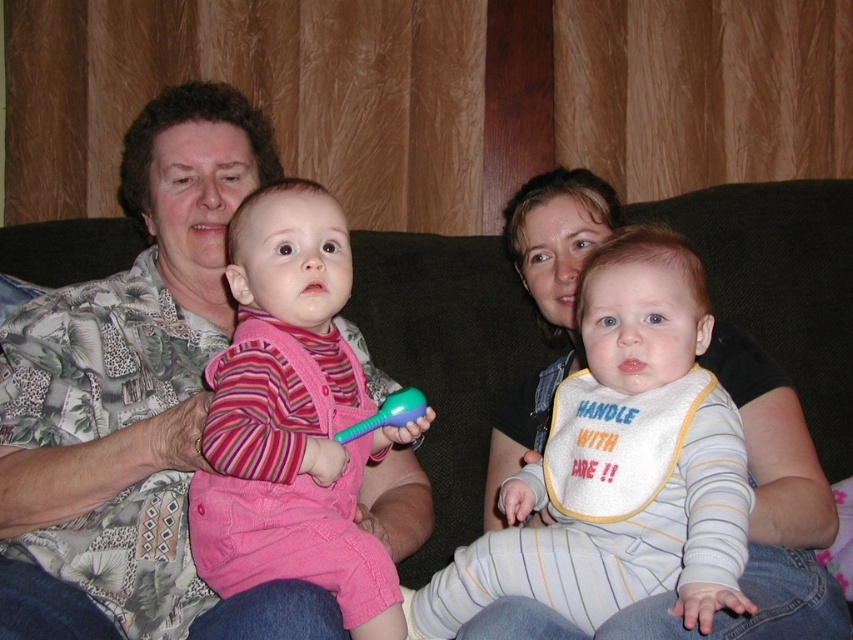
Describe the element at coordinates (134, 404) in the screenshot. The image size is (853, 640). I see `printed fabric shirt at left` at that location.

Is printed fabric shirt at left taller than pink corduroy overalls at center?

Correct, printed fabric shirt at left is much taller as pink corduroy overalls at center.

Is point (74, 298) positioned in front of point (229, 355)?

That is False.

Image resolution: width=853 pixels, height=640 pixels. Find the location of `printed fabric shirt at left`. printed fabric shirt at left is located at coordinates (134, 404).

Does white striped bib at center have a lesser width compared to pink corduroy overalls at center?

Incorrect, white striped bib at center's width is not less than pink corduroy overalls at center's.

Which is more to the left, white striped bib at center or pink corduroy overalls at center?

pink corduroy overalls at center is more to the left.

Identify the location of white striped bib at center. (619, 464).

Is printed fabric shirt at left wider than white striped bib at center?

Indeed, printed fabric shirt at left has a greater width compared to white striped bib at center.

Which is behind, point (30, 358) or point (685, 289)?

The point (30, 358) is more distant.

Is point (4, 394) more distant than point (705, 403)?

Yes, point (4, 394) is farther from viewer.

Find the location of a particular element. The width and height of the screenshot is (853, 640). printed fabric shirt at left is located at coordinates (134, 404).